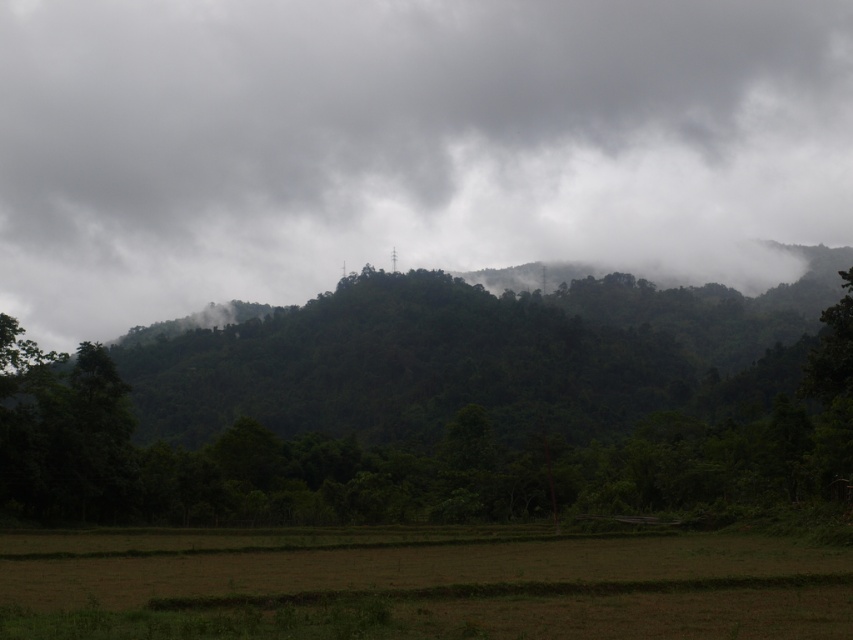
You are an airplane pilot flying over the serene landscape. You notice the white fluffy cloud at upper center and the brown grassland at lower center. Which object is located higher in the sky?

The white fluffy cloud at upper center is positioned over the brown grassland at lower center, so it is higher in the sky.

You are an artist trying to paint the landscape. You notice the white fluffy cloud at upper center and the brown grassland at lower center. Which one do you think covers a larger area in the painting?

The white fluffy cloud at upper center might be wider than brown grassland at lower center, so it likely covers a larger area in the painting.